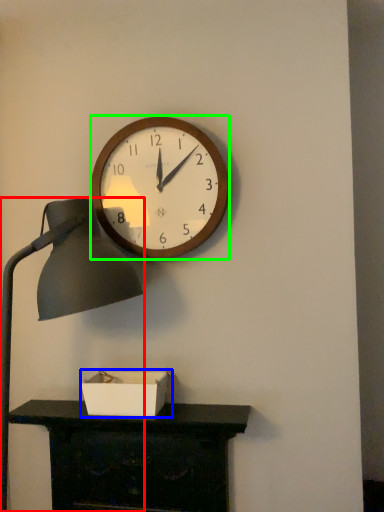
Question: Which object is positioned farthest from lamp (highlighted by a red box)? Select from box (highlighted by a blue box) and wall clock (highlighted by a green box).

Choices:
 (A) box
 (B) wall clock

Answer: (A)